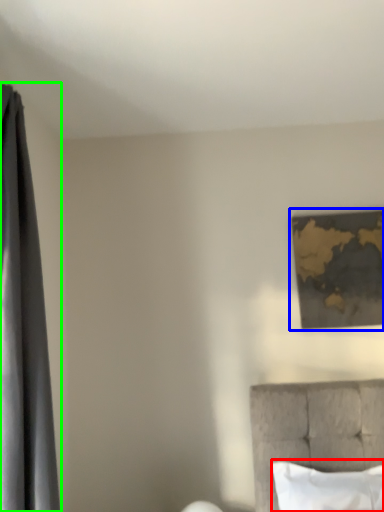
Question: Estimate the real-world distances between objects in this image. Which object is farther from pillow (highlighted by a red box), picture frame (highlighted by a blue box) or curtain (highlighted by a green box)?

Choices:
 (A) picture frame
 (B) curtain

Answer: (B)